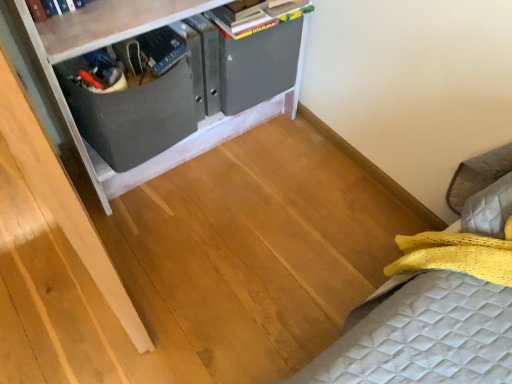
You are a GUI agent. You are given a task and a screenshot of the screen. Output one action in this format:
    pyautogui.click(x=<x>, y=<y>)
    Task: Click on the vacant space in front of matte gray cabinet at upper left
    Image resolution: width=512 pixels, height=384 pixels.
    Given the screenshot: What is the action you would take?
    pyautogui.click(x=194, y=263)